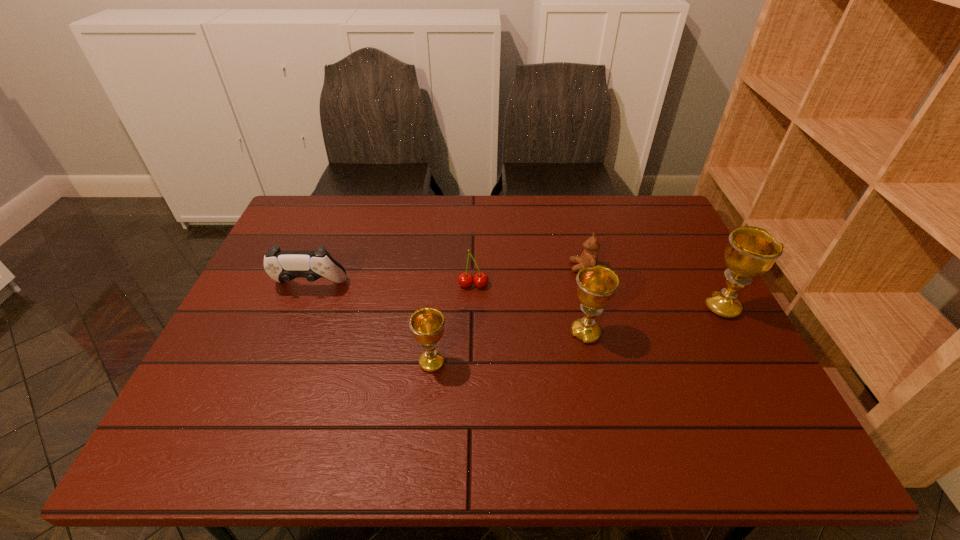
At what (x,y) coordinates should I click in order to perform the action: click on blank space at the near edge of the desktop. Please return your answer as a coordinate pair (x, y). Image resolution: width=960 pixels, height=540 pixels. Looking at the image, I should click on (541, 407).

Image resolution: width=960 pixels, height=540 pixels. I want to click on free region at the left edge, so click(x=272, y=314).

Locate an element on the screen. This screenshot has width=960, height=540. free space at the far left corner of the desktop is located at coordinates (323, 218).

What are the coordinates of `free space at the far right corner of the desktop` in the screenshot? It's located at pyautogui.click(x=660, y=231).

The image size is (960, 540). I want to click on blank space at the near right corner of the desktop, so 763,384.

The image size is (960, 540). Identify the location of empty space between the nearest object and the leftmost object. (371, 324).

I want to click on free area in between the control and the cherry, so click(x=392, y=286).

You are a GUI agent. You are given a task and a screenshot of the screen. Output one action in this format:
    pyautogui.click(x=<x>, y=<y>)
    Task: Click on the vacant space in between the tallest chalice and the control
    Image resolution: width=960 pixels, height=540 pixels.
    Given the screenshot: What is the action you would take?
    pyautogui.click(x=516, y=297)

The image size is (960, 540). In order to click on empty location between the second tallest chalice and the cherry in this screenshot , I will do `click(529, 309)`.

This screenshot has width=960, height=540. I want to click on vacant area that lies between the leftmost object and the fourth object from right to left, so click(392, 286).